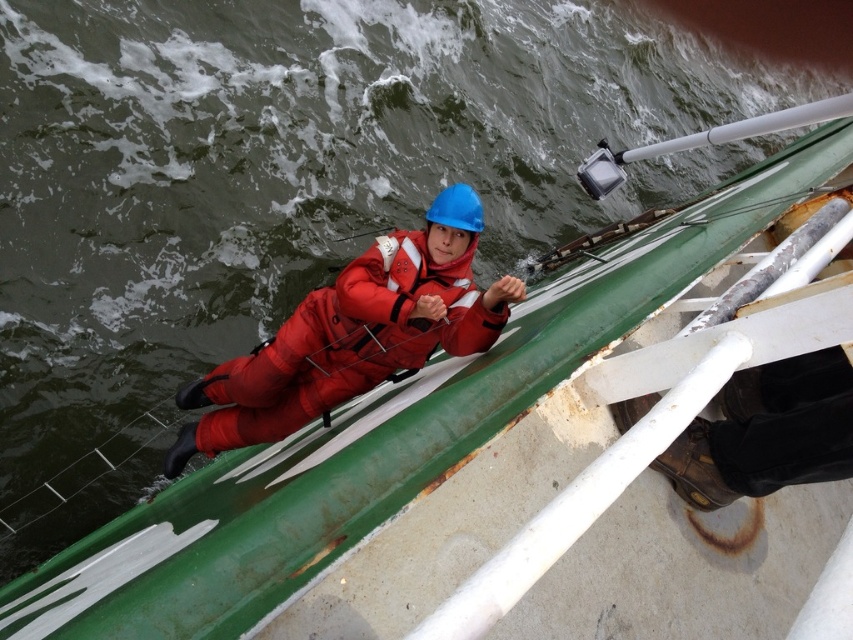
You are a safety inspector on the boat and need to ensure all equipment is properly positioned. According to the image, is the red matte suit at center located to the left or right of the red matte life jacket at center?

The red matte suit at center is to the left of the red matte life jacket at center.

You are on a boat and need to quickly grab either the red matte suit at center or the red matte life jacket at center. Which one can you reach first if you are facing the same direction as the person in the image?

The red matte suit at center is closer to the viewer than the red matte life jacket at center, so you can reach it first.

You are a safety inspector evaluating the equipment on the boat. You notice the red matte suit at center and the red matte life jacket at center. Which piece of equipment has a larger width according to the description?

The red matte suit at center is wider than the red matte life jacket at center according to the description.